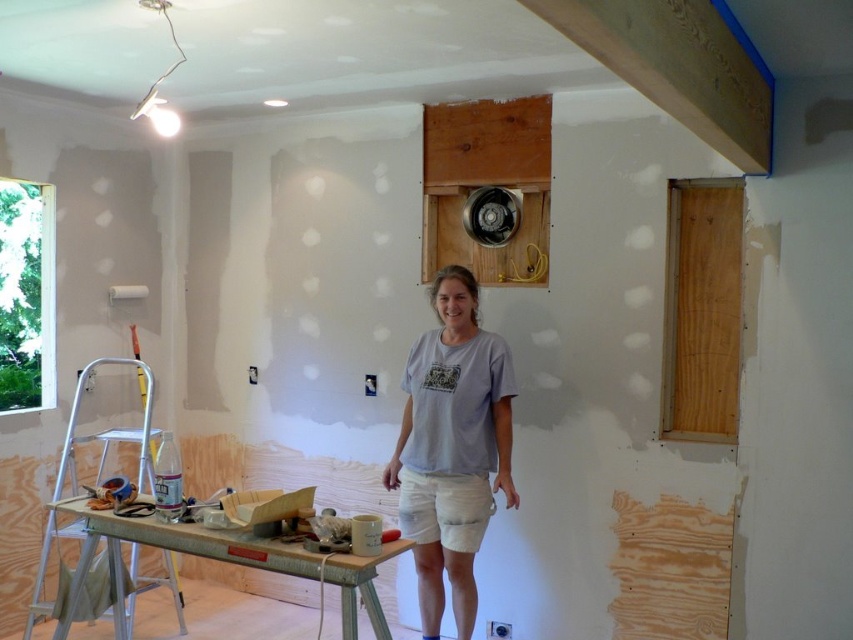
Is gray cotton t-shirt at center thinner than green painted wood beam at upper center?

Indeed, gray cotton t-shirt at center has a lesser width compared to green painted wood beam at upper center.

Who is more distant from viewer, [432,573] or [712,99]?

Positioned behind is point [432,573].

This screenshot has height=640, width=853. In order to click on gray cotton t-shirt at center in this screenshot , I will do `click(451, 448)`.

Consider the image. Which is more to the left, green painted wood beam at upper center or silver metallic ladder at lower left?

From the viewer's perspective, silver metallic ladder at lower left appears more on the left side.

Does green painted wood beam at upper center appear on the right side of silver metallic ladder at lower left?

Correct, you'll find green painted wood beam at upper center to the right of silver metallic ladder at lower left.

Between point (759, 134) and point (76, 481), which one is positioned in front?

Point (759, 134) is in front.

The image size is (853, 640). Identify the location of green painted wood beam at upper center. (677, 67).

Who is more distant from viewer, (450,384) or (178,604)?

The point (178,604) is behind.

Is point (477, 509) positioned before point (175, 586)?

That is True.

The height and width of the screenshot is (640, 853). Find the location of `gray cotton t-shirt at center`. gray cotton t-shirt at center is located at coordinates (451, 448).